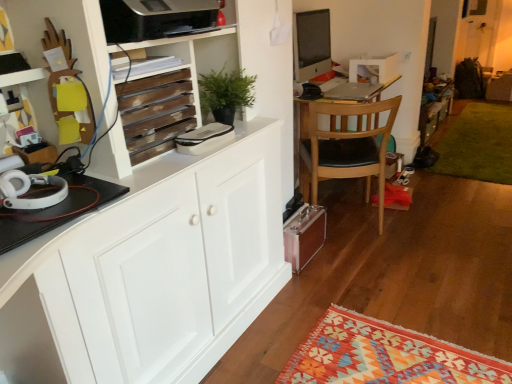
Find the location of `light brown wood chair at center`. light brown wood chair at center is located at coordinates (345, 146).

Where is `silver metallic laptop at center`? The width and height of the screenshot is (512, 384). silver metallic laptop at center is located at coordinates (354, 91).

Which point is more distant from viewer, (189, 102) or (375, 85)?

Positioned behind is point (375, 85).

Could you tell me if wooden slats at upper left is facing silver metallic laptop at center?

No, wooden slats at upper left is not turned towards silver metallic laptop at center.

From their relative heights in the image, would you say wooden slats at upper left is taller or shorter than silver metallic laptop at center?

wooden slats at upper left is taller than silver metallic laptop at center.

Is wooden slats at upper left directly adjacent to silver metallic laptop at center?

wooden slats at upper left is not next to silver metallic laptop at center, and they're not touching.

From a real-world perspective, is silver metallic laptop at center below wooden slats at upper left?

Yes, from a real-world perspective, silver metallic laptop at center is beneath wooden slats at upper left.

Considering the positions of points (355, 83) and (144, 102), is point (355, 83) closer to camera compared to point (144, 102)?

That is False.

Between silver metallic laptop at center and wooden slats at upper left, which one is positioned behind?

silver metallic laptop at center is further from the camera.

Could you tell me if silver metallic laptop at center is turned towards wooden slats at upper left?

No, silver metallic laptop at center does not turn towards wooden slats at upper left.

From a real-world perspective, which object rests below the other?

satin black monitor at upper center, from a real-world perspective.

Find the location of a particular element. The image size is (512, 384). desktop computer on the right of wooden slats at upper left is located at coordinates [x=311, y=44].

From the picture: Between wooden slats at upper left and satin black monitor at upper center, which one appears on the left side from the viewer's perspective?

From the viewer's perspective, wooden slats at upper left appears more on the left side.

Is wooden slats at upper left inside the boundaries of satin black monitor at upper center, or outside?

wooden slats at upper left is not enclosed by satin black monitor at upper center.

From a real-world perspective, is silver metallic laptop at center positioned above or below light brown wood chair at center?

silver metallic laptop at center is above light brown wood chair at center.

Which is behind, silver metallic laptop at center or light brown wood chair at center?

silver metallic laptop at center.

Between silver metallic laptop at center and light brown wood chair at center, which one appears on the left side from the viewer's perspective?

Positioned to the left is light brown wood chair at center.

Do you think silver metallic laptop at center is within light brown wood chair at center, or outside of it?

silver metallic laptop at center can be found inside light brown wood chair at center.

Consider the image. From the image's perspective, between satin black monitor at upper center and wooden slats at upper left, who is located below?

From the image's view, wooden slats at upper left is below.

Looking at the image, does satin black monitor at upper center seem bigger or smaller compared to wooden slats at upper left?

In the image, satin black monitor at upper center appears to be larger than wooden slats at upper left.

In the scene shown: Is wooden slats at upper left at the back of satin black monitor at upper center?

No, satin black monitor at upper center is not facing away from wooden slats at upper left.

Is satin black monitor at upper center next to wooden slats at upper left and touching it?

No.

From the image's perspective, which one is positioned lower, light brown wood chair at center or satin black monitor at upper center?

From the image's view, light brown wood chair at center is below.

Is light brown wood chair at center positioned beyond the bounds of satin black monitor at upper center?

Yes, light brown wood chair at center is located beyond the bounds of satin black monitor at upper center.

Based on their sizes in the image, would you say light brown wood chair at center is bigger or smaller than satin black monitor at upper center?

Considering their sizes, light brown wood chair at center takes up more space than satin black monitor at upper center.

Is light brown wood chair at center positioned far away from satin black monitor at upper center?

No, there isn't a large distance between light brown wood chair at center and satin black monitor at upper center.

From a real-world perspective, who is located lower, light brown wood chair at center or wooden slats at upper left?

light brown wood chair at center is physically lower.

Measure the distance between light brown wood chair at center and wooden slats at upper left.

1.32 meters.

Considering the positions of objects light brown wood chair at center and wooden slats at upper left in the image provided, who is more to the left, light brown wood chair at center or wooden slats at upper left?

wooden slats at upper left.

Is light brown wood chair at center in front of wooden slats at upper left?

That is False.

Find the location of a particular element. This screenshot has height=384, width=512. drawer below the silver metallic laptop at center (from the image's perspective) is located at coordinates (156, 113).

The height and width of the screenshot is (384, 512). In order to click on laptop on the right of wooden slats at upper left in this screenshot , I will do `click(354, 91)`.

Estimate the real-world distances between objects in this image. Which object is closer to satin black monitor at upper center, wooden slats at upper left or light brown wood chair at center?

light brown wood chair at center is closer to satin black monitor at upper center.

Which object lies further to the anchor point satin black monitor at upper center, light brown wood chair at center or silver metallic laptop at center?

The object further to satin black monitor at upper center is light brown wood chair at center.

Considering their positions, is light brown wood chair at center positioned further to silver metallic laptop at center than wooden slats at upper left?

wooden slats at upper left.

Looking at the image, which one is located further to wooden slats at upper left, light brown wood chair at center or silver metallic laptop at center?

silver metallic laptop at center is positioned further to the anchor wooden slats at upper left.

Based on the photo, based on their spatial positions, is wooden slats at upper left or silver metallic laptop at center closer to satin black monitor at upper center?

Based on the image, silver metallic laptop at center appears to be nearer to satin black monitor at upper center.

Looking at the image, which one is located further to silver metallic laptop at center, light brown wood chair at center or satin black monitor at upper center?

Based on the image, satin black monitor at upper center appears to be further to silver metallic laptop at center.

Considering their positions, is silver metallic laptop at center positioned closer to light brown wood chair at center than satin black monitor at upper center?

silver metallic laptop at center is closer to light brown wood chair at center.

Based on their spatial positions, is satin black monitor at upper center or wooden slats at upper left further from silver metallic laptop at center?

wooden slats at upper left is further to silver metallic laptop at center.

You are a GUI agent. You are given a task and a screenshot of the screen. Output one action in this format:
    pyautogui.click(x=<x>, y=<y>)
    Task: Click on the laptop between satin black monitor at upper center and light brown wood chair at center from top to bottom
    
    Given the screenshot: What is the action you would take?
    pyautogui.click(x=354, y=91)

You are a GUI agent. You are given a task and a screenshot of the screen. Output one action in this format:
    pyautogui.click(x=<x>, y=<y>)
    Task: Click on the chair between wooden slats at upper left and silver metallic laptop at center in the front-back direction
    
    Given the screenshot: What is the action you would take?
    pyautogui.click(x=345, y=146)

Where is `laptop located between wooden slats at upper left and satin black monitor at upper center in the depth direction`? The image size is (512, 384). laptop located between wooden slats at upper left and satin black monitor at upper center in the depth direction is located at coordinates (354, 91).

The height and width of the screenshot is (384, 512). What are the coordinates of `chair located between wooden slats at upper left and satin black monitor at upper center in the depth direction` in the screenshot? It's located at [x=345, y=146].